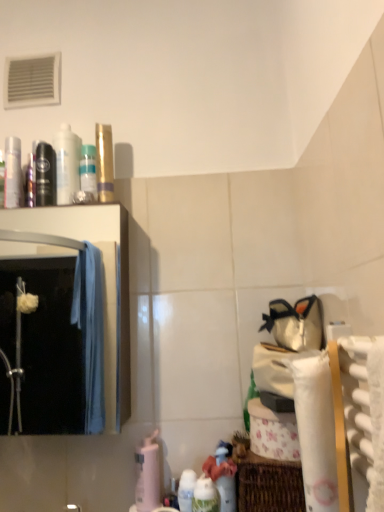
Question: Considering the relative sizes of white glossy bottle at lower center, which is counted as the 2th cleaning product, starting from the left, and gold metallic tube at upper center in the image provided, is white glossy bottle at lower center, which is counted as the 2th cleaning product, starting from the left, wider than gold metallic tube at upper center?

Choices:
 (A) yes
 (B) no

Answer: (B)

Question: Is white glossy bottle at lower center, which is the 2th cleaning product from front to back, smaller than gold metallic tube at upper center?

Choices:
 (A) yes
 (B) no

Answer: (A)

Question: Is white glossy bottle at lower center, the second cleaning product from the right, looking in the opposite direction of gold metallic tube at upper center?

Choices:
 (A) no
 (B) yes

Answer: (A)

Question: From a real-world perspective, is white glossy bottle at lower center, which is the 2th cleaning product from front to back, physically above gold metallic tube at upper center?

Choices:
 (A) yes
 (B) no

Answer: (B)

Question: Considering the relative positions of white glossy bottle at lower center, the second cleaning product from the right, and gold metallic tube at upper center in the image provided, is white glossy bottle at lower center, the second cleaning product from the right, to the right of gold metallic tube at upper center from the viewer's perspective?

Choices:
 (A) no
 (B) yes

Answer: (B)

Question: Is metallic silver mouthwash at left, marked as the 1th mouthwash in a left-to-right arrangement, to the left or to the right of clear glass mirror at left in the image?

Choices:
 (A) left
 (B) right

Answer: (A)

Question: Is metallic silver mouthwash at left, placed as the fourth mouthwash when sorted from right to left, inside the boundaries of clear glass mirror at left, or outside?

Choices:
 (A) inside
 (B) outside

Answer: (B)

Question: Is metallic silver mouthwash at left, placed as the fourth mouthwash when sorted from right to left, taller or shorter than clear glass mirror at left?

Choices:
 (A) short
 (B) tall

Answer: (A)

Question: From a real-world perspective, relative to clear glass mirror at left, is metallic silver mouthwash at left, marked as the 1th mouthwash in a left-to-right arrangement, vertically above or below?

Choices:
 (A) below
 (B) above

Answer: (B)

Question: Is point (92, 182) closer or farther from the camera than point (317, 471)?

Choices:
 (A) farther
 (B) closer

Answer: (A)

Question: In the image, is translucent plastic bottle at upper center, which is counted as the fourth mouthwash, starting from the left, positioned in front of or behind white paper towel at lower right?

Choices:
 (A) behind
 (B) front

Answer: (A)

Question: Is translucent plastic bottle at upper center, which is counted as the fourth mouthwash, starting from the left, to the left or to the right of white paper towel at lower right in the image?

Choices:
 (A) right
 (B) left

Answer: (B)

Question: Is translucent plastic bottle at upper center, which is counted as the fourth mouthwash, starting from the left, wider or thinner than white paper towel at lower right?

Choices:
 (A) wide
 (B) thin

Answer: (B)

Question: Is white glossy bottle at lower center, arranged as the third cleaning product when viewed from the left, in front of or behind white paper towel at lower right in the image?

Choices:
 (A) behind
 (B) front

Answer: (A)

Question: In the image, is white glossy bottle at lower center, the first cleaning product from the front, on the left side or the right side of white paper towel at lower right?

Choices:
 (A) right
 (B) left

Answer: (B)